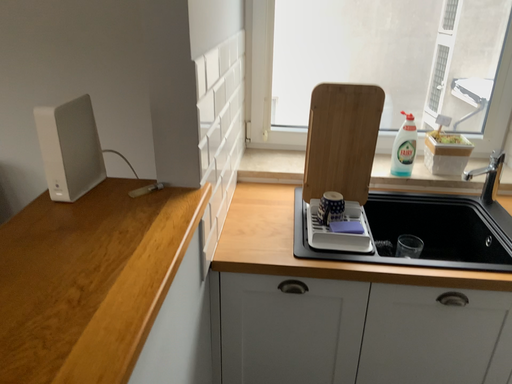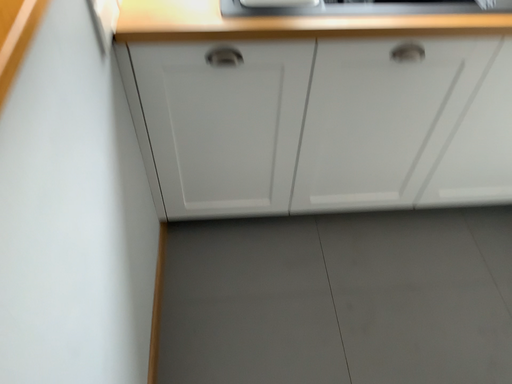
Question: How did the camera likely rotate when shooting the video?

Choices:
 (A) rotated upward
 (B) rotated downward

Answer: (B)